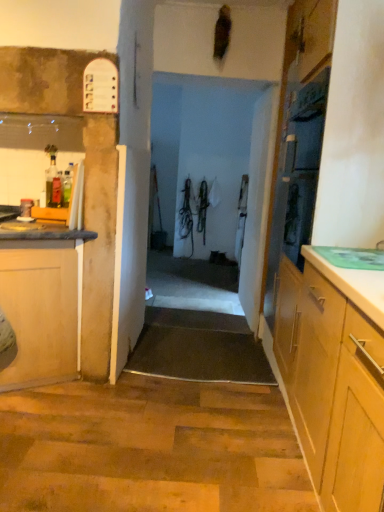
Question: Is white matte door at center to the right of wooden cabinet at left from the viewer's perspective?

Choices:
 (A) yes
 (B) no

Answer: (A)

Question: Is the position of white matte door at center less distant than that of wooden cabinet at left?

Choices:
 (A) no
 (B) yes

Answer: (A)

Question: Considering the relative sizes of white matte door at center and wooden cabinet at left in the image provided, is white matte door at center shorter than wooden cabinet at left?

Choices:
 (A) no
 (B) yes

Answer: (A)

Question: Considering the relative sizes of white matte door at center and wooden cabinet at left in the image provided, is white matte door at center bigger than wooden cabinet at left?

Choices:
 (A) no
 (B) yes

Answer: (A)

Question: From the image's perspective, is white matte door at center located beneath wooden cabinet at left?

Choices:
 (A) yes
 (B) no

Answer: (B)

Question: Is white matte door at center further to the viewer compared to wooden cabinet at left?

Choices:
 (A) no
 (B) yes

Answer: (B)

Question: Can you confirm if wooden cabinet at left is shorter than white matte door at center?

Choices:
 (A) no
 (B) yes

Answer: (B)

Question: Considering the relative positions of wooden cabinet at left and white matte door at center in the image provided, is wooden cabinet at left to the right of white matte door at center from the viewer's perspective?

Choices:
 (A) no
 (B) yes

Answer: (A)

Question: Could you tell me if wooden cabinet at left is turned towards white matte door at center?

Choices:
 (A) no
 (B) yes

Answer: (A)

Question: From the image's perspective, is wooden cabinet at left located beneath white matte door at center?

Choices:
 (A) yes
 (B) no

Answer: (A)

Question: Is wooden cabinet at left next to white matte door at center?

Choices:
 (A) no
 (B) yes

Answer: (A)

Question: Considering the relative sizes of wooden cabinet at left and white matte door at center in the image provided, is wooden cabinet at left wider than white matte door at center?

Choices:
 (A) no
 (B) yes

Answer: (A)

Question: In terms of size, does wooden cabinet at left appear bigger or smaller than white matte door at center?

Choices:
 (A) small
 (B) big

Answer: (B)